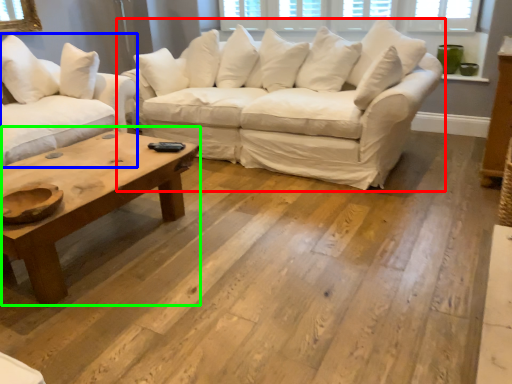
Question: Which is nearer to the studio couch (highlighted by a red box)? studio couch (highlighted by a blue box) or coffee table (highlighted by a green box).

Choices:
 (A) studio couch
 (B) coffee table

Answer: (A)